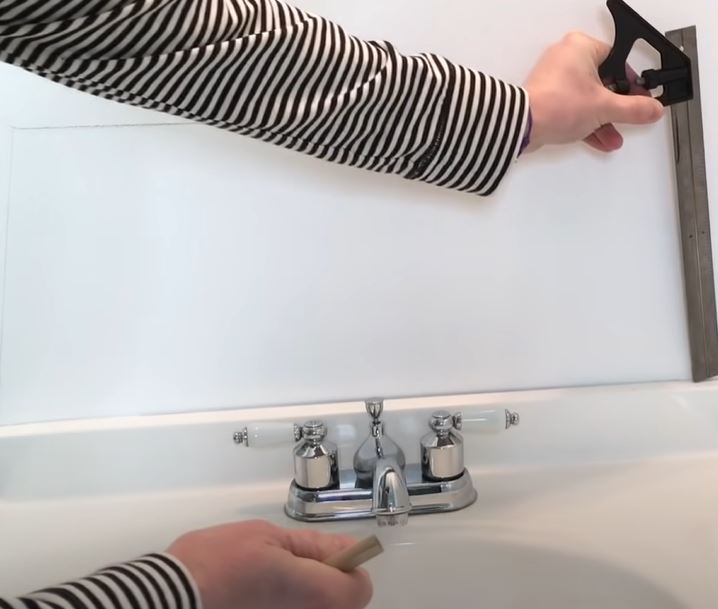
Identify the location of sink. The height and width of the screenshot is (609, 718). (597, 524).